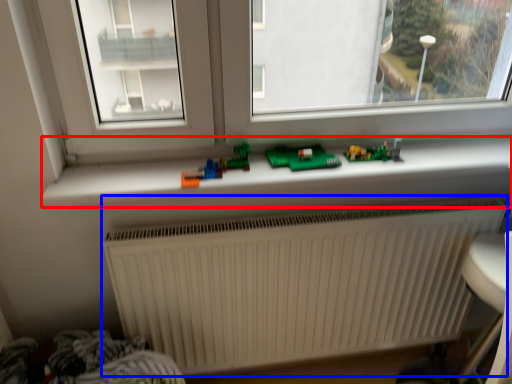
Question: Which point is further to the camera, window sill (highlighted by a red box) or radiator (highlighted by a blue box)?

Choices:
 (A) window sill
 (B) radiator

Answer: (B)